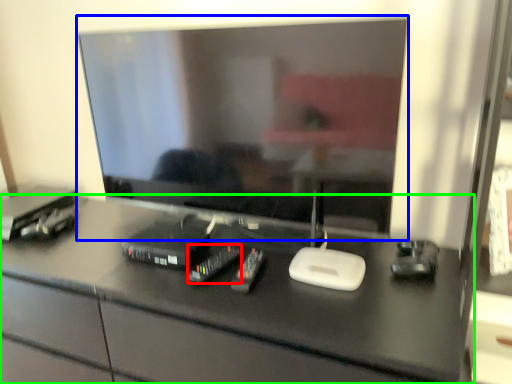
Question: Considering the real-world distances, which object is farthest from equipment (highlighted by a red box)? television (highlighted by a blue box) or desk (highlighted by a green box)?

Choices:
 (A) television
 (B) desk

Answer: (A)